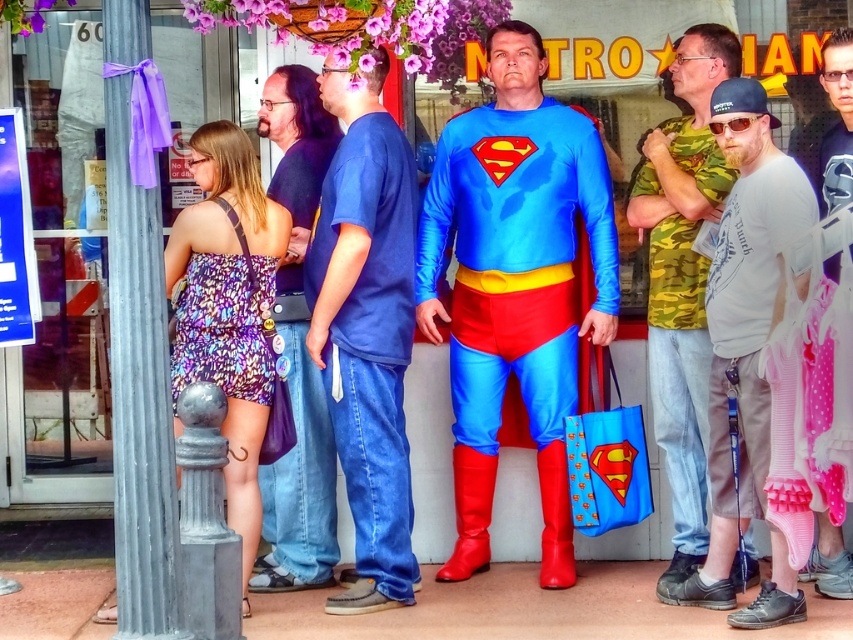
Is blue cotton t-shirt at center below gray cotton t-shirt at center-right?

Actually, blue cotton t-shirt at center is above gray cotton t-shirt at center-right.

What do you see at coordinates (367, 330) in the screenshot? This screenshot has height=640, width=853. I see `blue cotton t-shirt at center` at bounding box center [367, 330].

Which is in front, point (355, 276) or point (740, 458)?

Positioned in front is point (740, 458).

This screenshot has width=853, height=640. I want to click on blue cotton t-shirt at center, so click(x=367, y=330).

Is blue cotton t-shirt at center shorter than blue denim jeans at center?

Yes.

Can you confirm if blue cotton t-shirt at center is wider than blue denim jeans at center?

Indeed, blue cotton t-shirt at center has a greater width compared to blue denim jeans at center.

Is point (358, 524) behind point (302, 141)?

No, it is not.

Where is `blue cotton t-shirt at center`? blue cotton t-shirt at center is located at coordinates (367, 330).

Is blue cotton t-shirt at center closer to camera compared to printed fabric dress at center?

Yes, blue cotton t-shirt at center is closer to the viewer.

Which is above, blue cotton t-shirt at center or printed fabric dress at center?

printed fabric dress at center

Between point (358, 308) and point (231, 353), which one is positioned in front?

Point (231, 353)

The height and width of the screenshot is (640, 853). I want to click on blue cotton t-shirt at center, so pos(367,330).